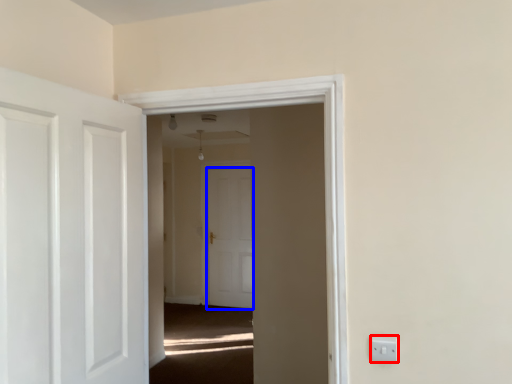
Question: Which object is further to the camera taking this photo, electric outlet (highlighted by a red box) or door (highlighted by a blue box)?

Choices:
 (A) electric outlet
 (B) door

Answer: (B)